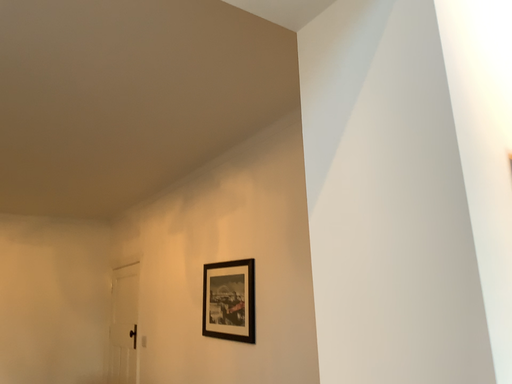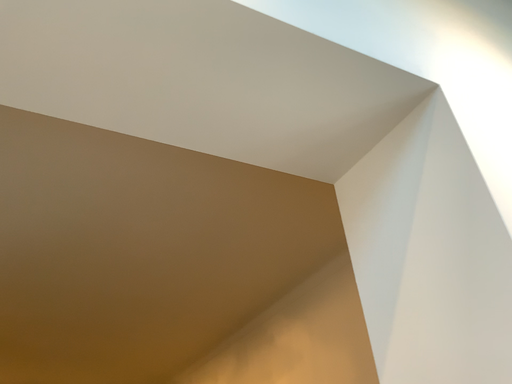
Question: Which way did the camera rotate in the video?

Choices:
 (A) rotated upward
 (B) rotated downward

Answer: (A)